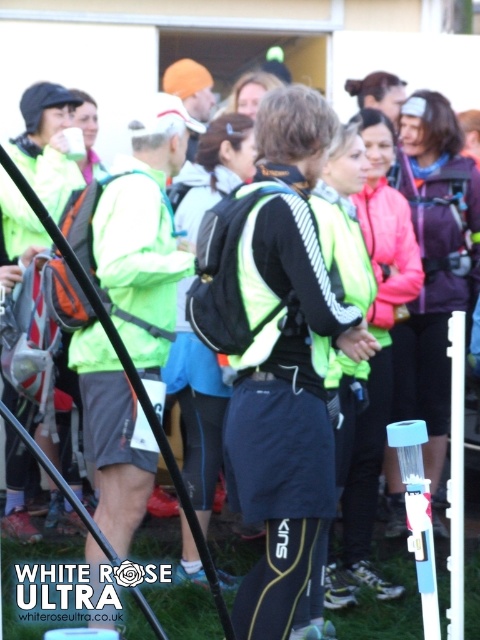
Question: Considering the relative positions of green matte jacket at center and purple fleece vest at center in the image provided, where is green matte jacket at center located with respect to purple fleece vest at center?

Choices:
 (A) above
 (B) below

Answer: (B)

Question: Can you confirm if neon green reflective safety vest at center is bigger than blue plastic water bottle at center?

Choices:
 (A) no
 (B) yes

Answer: (B)

Question: Which point appears farthest from the camera in this image?

Choices:
 (A) (268, 275)
 (B) (421, 563)

Answer: (A)

Question: Is neon green reflective safety vest at center below blue plastic water bottle at center?

Choices:
 (A) yes
 (B) no

Answer: (B)

Question: Which object appears closest to the camera in this image?

Choices:
 (A) green matte jacket at center
 (B) neon green reflective safety vest at center

Answer: (B)

Question: Which object is positioned closest to the blue plastic water bottle at center?

Choices:
 (A) purple fleece vest at center
 (B) neon green reflective safety vest at center
 (C) green matte vest at center
 (D) green matte jacket at center

Answer: (B)